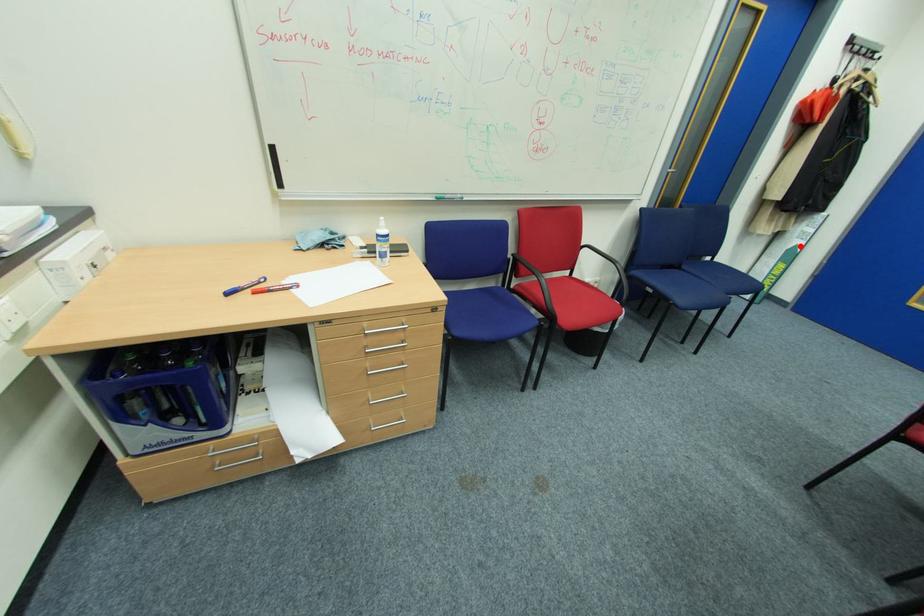
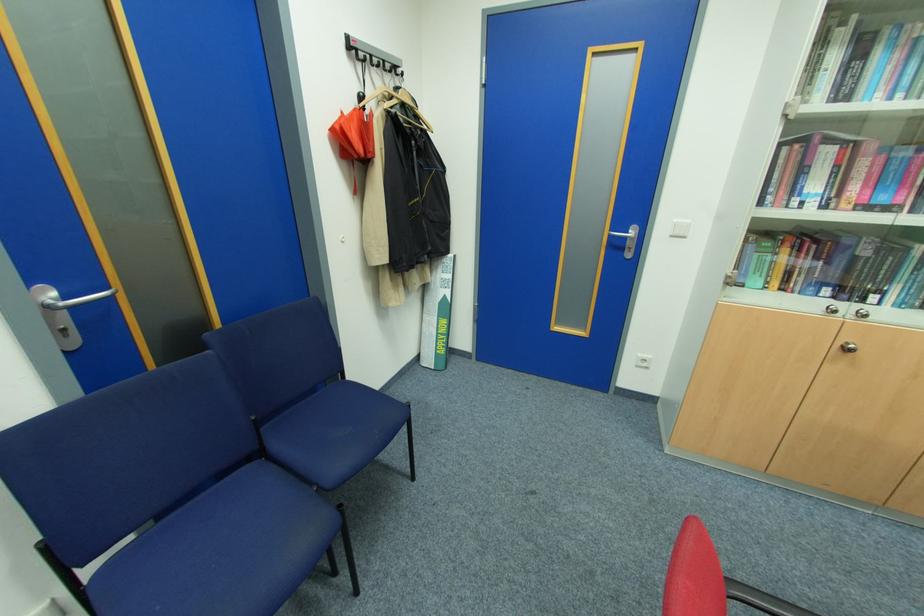
Question: I am providing you with two images of the same scene from different viewpoints. In image1, a red point is highlighted. Considering the same 3D point in image2, which of the following is correct?

Choices:
 (A) It is closer
 (B) It is farther

Answer: (A)